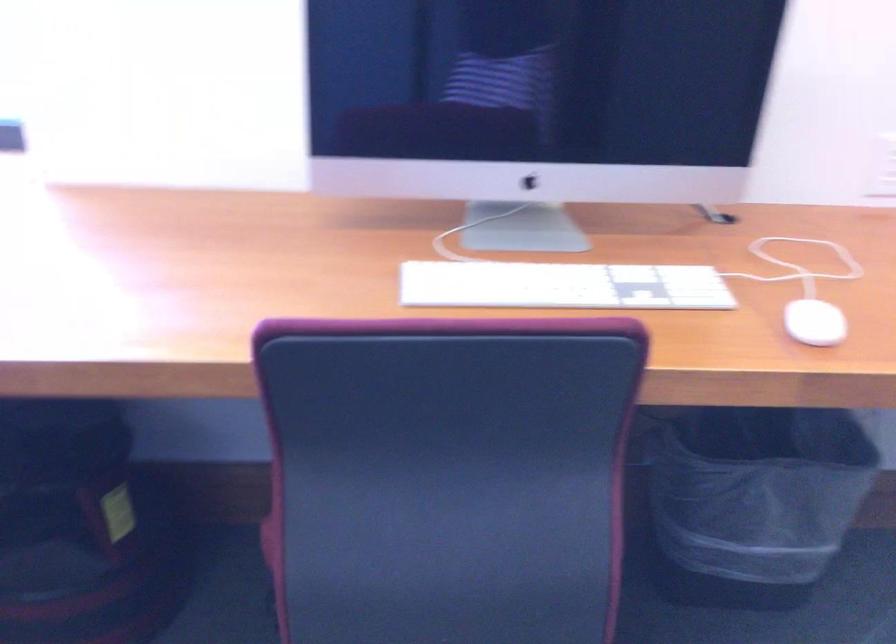
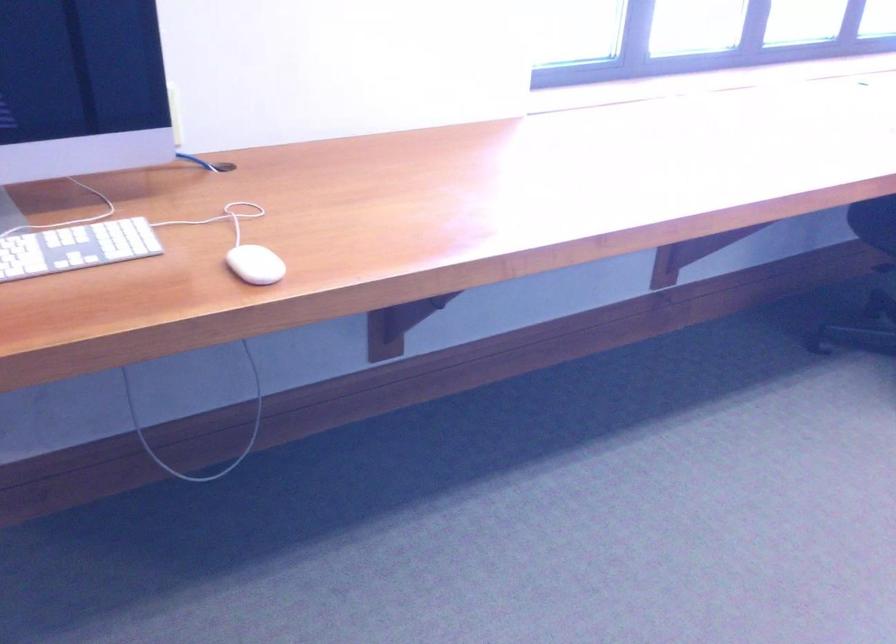
Question: What movement of the cameraman would produce the second image?

Choices:
 (A) Left
 (B) Right
 (C) Forward
 (D) Backward

Answer: (A)